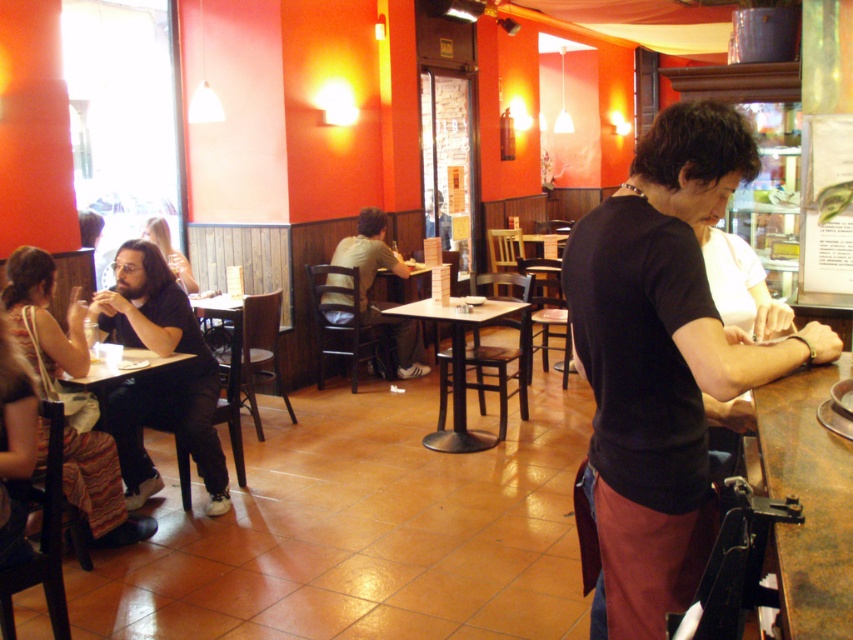
You are a server in the cozy cafe with bold red walls. You need to deliver a drink to the rustic wood table at bar and also pick up a dropped item from the matte black shirt at left. If you can only move 10 feet in one trip, can you complete both tasks without needing to return to the starting point?

The distance between the rustic wood table at bar and the matte black shirt at left is 9.56 feet. Since the total distance required to go from one to the other and back would be 19.12 feet, which exceeds the 10 feet limit, you cannot complete both tasks in one trip without returning. However, if you start at the starting point, you can first go to the rustic wood table at bar, then to the matte black shirt at left, totaling 9.56 feet, which is within the 10 feet limit. Therefore, you can complete both tasks

What is the location of the rustic wood table at bar in the image?

The rustic wood table at bar is located at point 0.783 on the x axis and 0.946 on the y axis.

You are a customer entering the cozy cafe and want to sit at a table that can accommodate your group of four. The rustic wood table at bar and the matte black shirt at left are the only available options. Which table should you choose?

The matte black shirt at left is larger than the rustic wood table at bar, so you should choose the matte black shirt at left to accommodate your group of four.